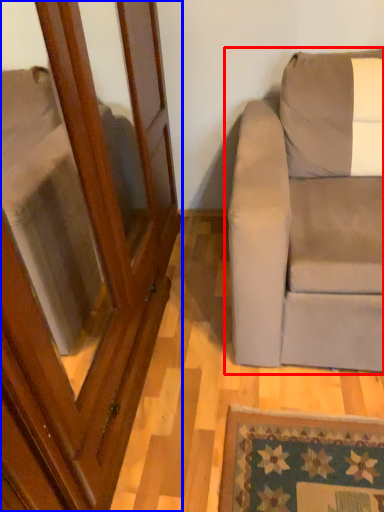
Question: Which of the following is the closest to the observer, studio couch (highlighted by a red box) or screen door (highlighted by a blue box)?

Choices:
 (A) studio couch
 (B) screen door

Answer: (B)